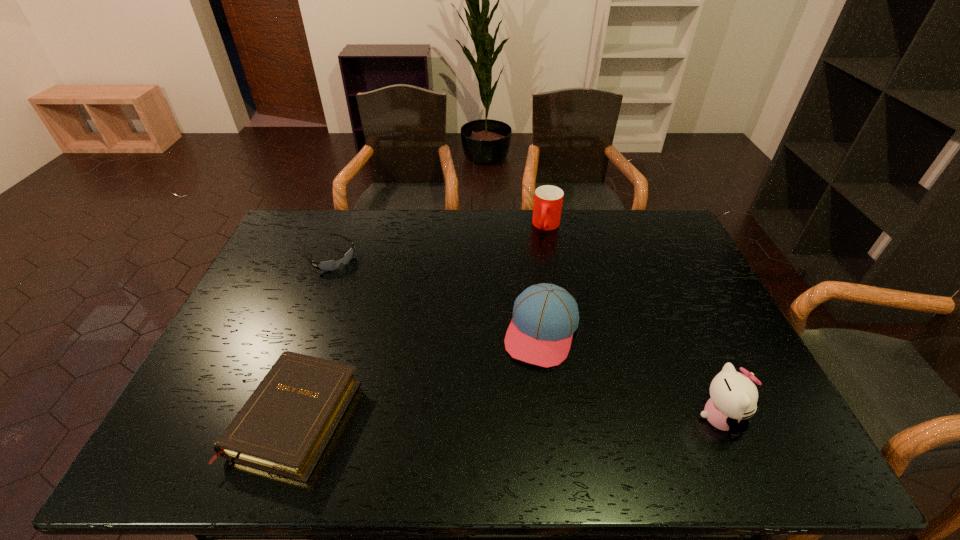
Locate an element on the screen. The height and width of the screenshot is (540, 960). kitten situated at the near edge is located at coordinates (734, 397).

The image size is (960, 540). Find the location of `Bible situated at the left edge`. Bible situated at the left edge is located at coordinates (283, 428).

Locate an element on the screen. sunglasses that is at the left edge is located at coordinates (330, 265).

Where is `object located at the right edge`? The width and height of the screenshot is (960, 540). object located at the right edge is located at coordinates (734, 397).

Find the location of a particular element. Image resolution: width=960 pixels, height=540 pixels. object located at the far left corner is located at coordinates (330, 265).

Find the location of a particular element. The width and height of the screenshot is (960, 540). object that is positioned at the near left corner is located at coordinates (283, 428).

Locate an element on the screen. This screenshot has height=540, width=960. object located at the near right corner is located at coordinates (734, 397).

In the image, there is a desktop. Identify the location of vacant space at the far edge. This screenshot has height=540, width=960. (407, 229).

Identify the location of vacant space at the near edge of the desktop. The width and height of the screenshot is (960, 540). (616, 391).

Where is `free point at the left edge`? free point at the left edge is located at coordinates (268, 308).